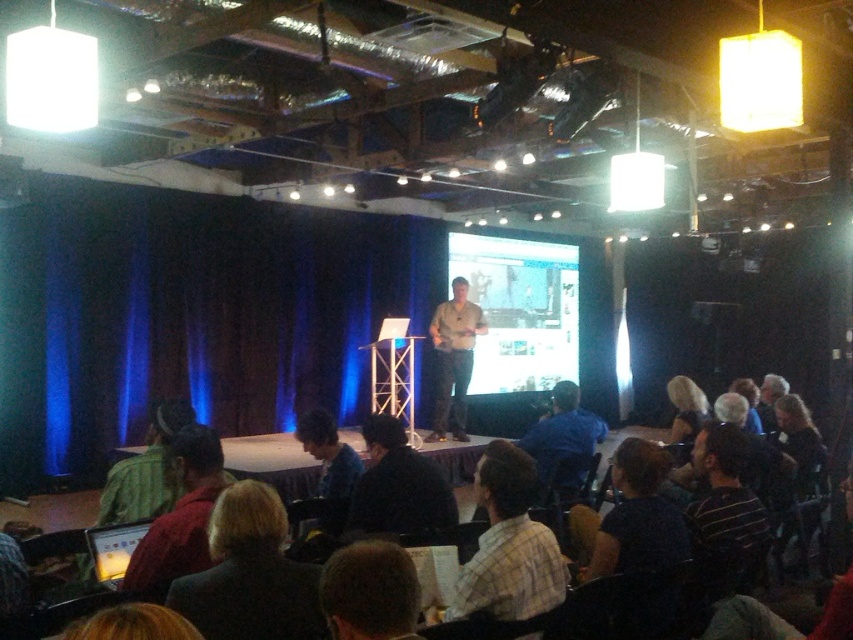
You are an attendee at the presentation and need to ask a question. The speaker is wearing a blue shirt at center, and there is also a khaki cotton shirt at center. Which shirt should you look at to address the speaker?

The blue shirt at center is in front of the khaki cotton shirt at center, so you should look at the blue shirt at center to address the speaker.